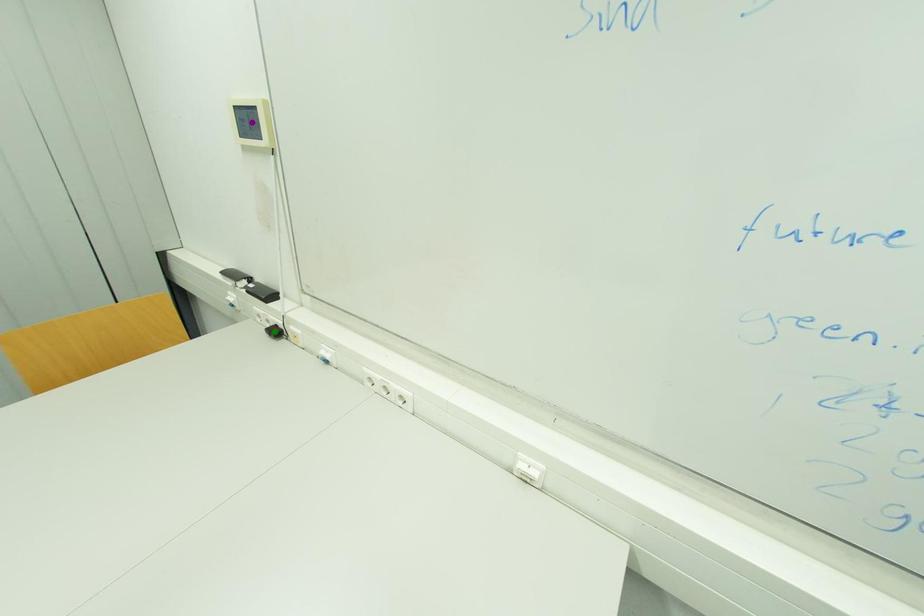
Order these from nearest to farthest:
red point
purple point
green point

1. purple point
2. red point
3. green point